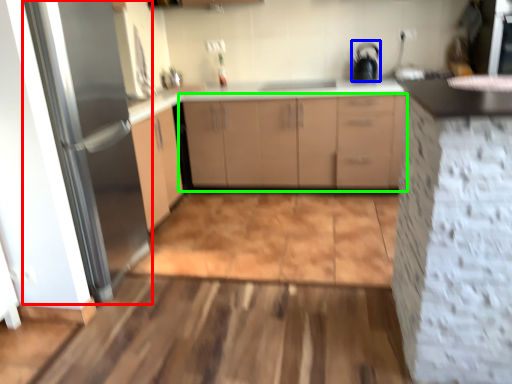
Question: Estimate the real-world distances between objects in this image. Which object is farther from fridge (highlighted by a red box), appliance (highlighted by a blue box) or cabinetry (highlighted by a green box)?

Choices:
 (A) appliance
 (B) cabinetry

Answer: (A)